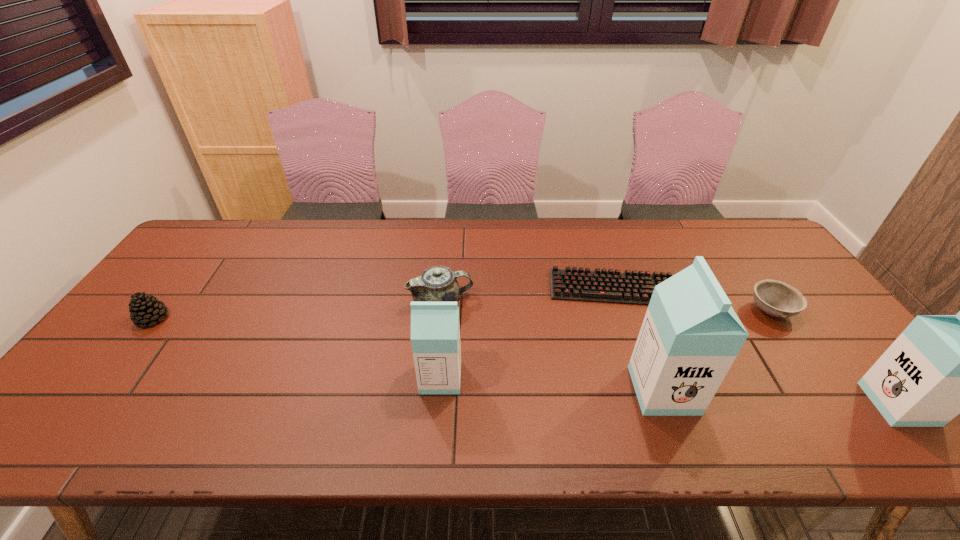
At what (x,y) coordinates should I click in order to perform the action: click on free space between the computer keyboard and the fourth shortest object. Please return your answer as a coordinate pair (x, y). Looking at the image, I should click on (527, 295).

Find the location of a particular element. The height and width of the screenshot is (540, 960). unoccupied area between the shortest milk carton and the second object from right to left is located at coordinates (606, 345).

This screenshot has width=960, height=540. In order to click on vacant space in between the second milk carton from left to right and the third tallest object in this screenshot , I will do `click(552, 384)`.

Image resolution: width=960 pixels, height=540 pixels. What are the coordinates of `vacant region between the second milk carton from left to right and the leftmost milk carton` in the screenshot? It's located at (552, 384).

Find the location of a particular element. This screenshot has width=960, height=540. free area in between the leftmost object and the chinaware is located at coordinates (297, 310).

The image size is (960, 540). In order to click on blank region between the computer keyboard and the rightmost object in this screenshot , I will do `click(756, 346)`.

The height and width of the screenshot is (540, 960). Find the location of `free space between the sixth tallest object and the shortest milk carton`. free space between the sixth tallest object and the shortest milk carton is located at coordinates (606, 345).

Image resolution: width=960 pixels, height=540 pixels. I want to click on vacant area that lies between the second shortest object and the fifth tallest object, so click(462, 315).

The height and width of the screenshot is (540, 960). What are the coordinates of `object that is the closest to the shortest object` in the screenshot? It's located at (775, 298).

Locate an element on the screen. This screenshot has width=960, height=540. object that is the second closest to the third tallest object is located at coordinates (629, 287).